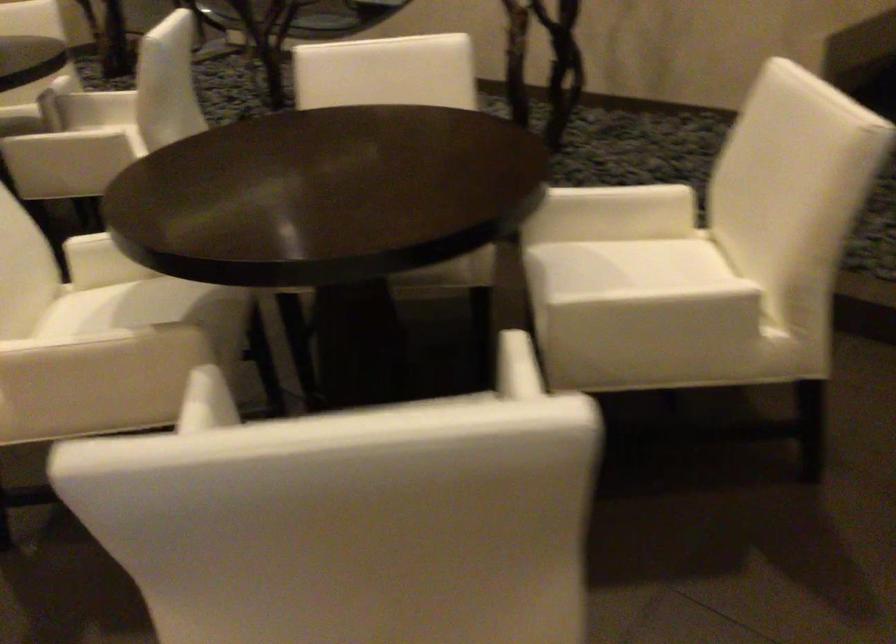
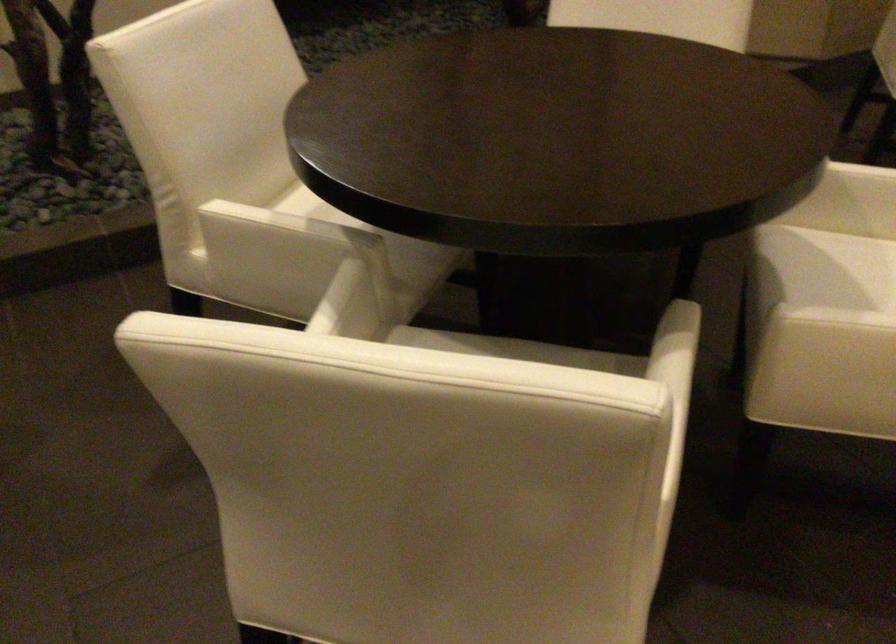
In the second image, find the point that corresponds to [316,328] in the first image.

(505, 327)